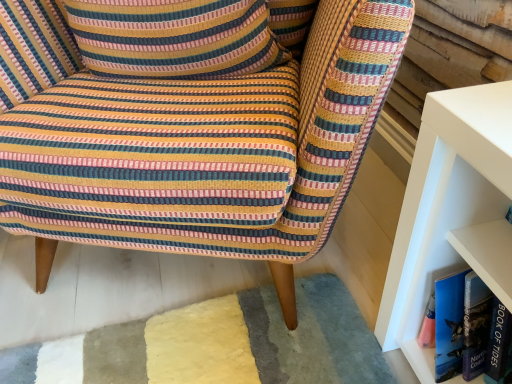
This screenshot has width=512, height=384. In order to click on striped fabric chair at center in this screenshot , I will do `click(192, 124)`.

What do you see at coordinates (174, 38) in the screenshot? This screenshot has width=512, height=384. I see `striped fabric pillow at upper left` at bounding box center [174, 38].

What do you see at coordinates (466, 328) in the screenshot? I see `blue hardcover book at right` at bounding box center [466, 328].

What are the coordinates of `striped fabric chair at center` in the screenshot? It's located at (192, 124).

Is striped fabric chair at center next to striped fabric pillow at upper left and touching it?

No, striped fabric chair at center is not beside striped fabric pillow at upper left.

Is striped fabric chair at center turned away from striped fabric pillow at upper left?

Absolutely, striped fabric chair at center is directed away from striped fabric pillow at upper left.

From a real-world perspective, which is physically above, striped fabric chair at center or striped fabric pillow at upper left?

From a 3D spatial view, striped fabric pillow at upper left is above.

Do you think blue hardcover book at right is within striped fabric pillow at upper left, or outside of it?

blue hardcover book at right is not enclosed by striped fabric pillow at upper left.

Looking at this image, is blue hardcover book at right smaller than striped fabric pillow at upper left?

Yes, blue hardcover book at right is smaller than striped fabric pillow at upper left.

The image size is (512, 384). Identify the location of book on the right side of striped fabric pillow at upper left. (466, 328).

Considering the sizes of blue hardcover book at right and striped fabric pillow at upper left in the image, is blue hardcover book at right taller or shorter than striped fabric pillow at upper left?

In the image, blue hardcover book at right appears to be taller than striped fabric pillow at upper left.

Is point (243, 8) positioned behind point (468, 331)?

That is True.

Is striped fabric pillow at upper left smaller than blue hardcover book at right?

Incorrect, striped fabric pillow at upper left is not smaller in size than blue hardcover book at right.

From a real-world perspective, who is located higher, striped fabric pillow at upper left or blue hardcover book at right?

striped fabric pillow at upper left is physically above.

Is striped fabric pillow at upper left next to blue hardcover book at right?

striped fabric pillow at upper left is not next to blue hardcover book at right, and they're not touching.

Considering the relative sizes of striped fabric pillow at upper left and striped fabric chair at center in the image provided, is striped fabric pillow at upper left wider than striped fabric chair at center?

No.

Is striped fabric pillow at upper left smaller than striped fabric chair at center?

Correct, striped fabric pillow at upper left occupies less space than striped fabric chair at center.

From the image's perspective, which object appears higher, striped fabric pillow at upper left or striped fabric chair at center?

striped fabric pillow at upper left appears higher in the image.

Is striped fabric chair at center in contact with blue hardcover book at right?

No, striped fabric chair at center is not next to blue hardcover book at right.

Is striped fabric chair at center taller or shorter than blue hardcover book at right?

striped fabric chair at center is taller than blue hardcover book at right.

Between striped fabric chair at center and blue hardcover book at right, which one appears on the left side from the viewer's perspective?

striped fabric chair at center.

Can you confirm if blue hardcover book at right is wider than striped fabric chair at center?

In fact, blue hardcover book at right might be narrower than striped fabric chair at center.

Between point (453, 357) and point (269, 56), which one is positioned behind?

The point (269, 56) is more distant.

Relative to striped fabric chair at center, is blue hardcover book at right in front or behind?

In the image, blue hardcover book at right appears behind striped fabric chair at center.

The height and width of the screenshot is (384, 512). I want to click on chair that appears in front of the striped fabric pillow at upper left, so [192, 124].

Locate an element on the screen. The height and width of the screenshot is (384, 512). pillow on the left side of blue hardcover book at right is located at coordinates (174, 38).

Looking at the image, which one is located closer to blue hardcover book at right, striped fabric chair at center or striped fabric pillow at upper left?

striped fabric chair at center.

When comparing their distances from blue hardcover book at right, does striped fabric pillow at upper left or striped fabric chair at center seem further?

striped fabric pillow at upper left.

When comparing their distances from striped fabric chair at center, does striped fabric pillow at upper left or blue hardcover book at right seem further?

The object further to striped fabric chair at center is blue hardcover book at right.

Which object lies further to the anchor point striped fabric pillow at upper left, striped fabric chair at center or blue hardcover book at right?

blue hardcover book at right is positioned further to the anchor striped fabric pillow at upper left.

From the image, which object appears to be nearer to striped fabric chair at center, blue hardcover book at right or striped fabric pillow at upper left?

The object closer to striped fabric chair at center is striped fabric pillow at upper left.

When comparing their distances from striped fabric pillow at upper left, does blue hardcover book at right or striped fabric chair at center seem further?

blue hardcover book at right.

This screenshot has width=512, height=384. Identify the location of chair located between striped fabric pillow at upper left and blue hardcover book at right in the left-right direction. (192, 124).